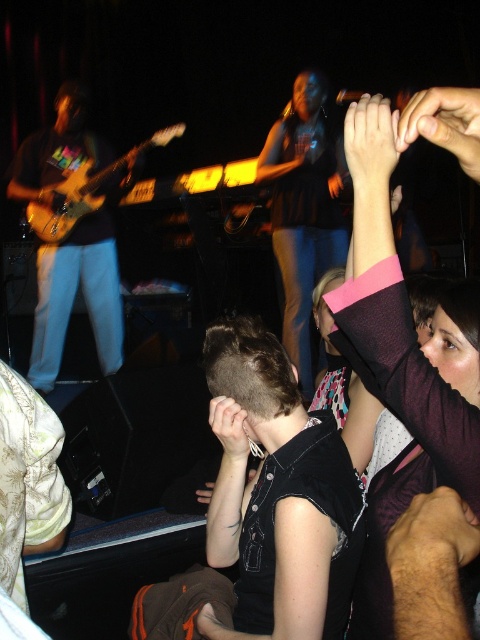
Question: Can you confirm if leather-like hand at upper right is positioned below matte black hand at center?

Choices:
 (A) no
 (B) yes

Answer: (A)

Question: Where is denim jeans at center located in relation to pink fabric hand at upper center in the image?

Choices:
 (A) below
 (B) above

Answer: (B)

Question: Among these points, which one is nearest to the camera?

Choices:
 (A) (69, 230)
 (B) (216, 432)
 (C) (387, 113)

Answer: (C)

Question: Can you confirm if denim jeans at center is wider than leather-like hand at upper right?

Choices:
 (A) yes
 (B) no

Answer: (A)

Question: Based on their relative distances, which object is farther from the smooth skin hand at upper right?

Choices:
 (A) leather-like hand at upper right
 (B) denim jeans at center
 (C) matte black hand at center
 (D) pink fabric hand at upper center

Answer: (B)

Question: Among these objects, which one is farthest from the camera?

Choices:
 (A) matte black hand at center
 (B) pink fabric hand at upper center
 (C) wooden electric guitar at left
 (D) leather-like hand at upper right

Answer: (C)